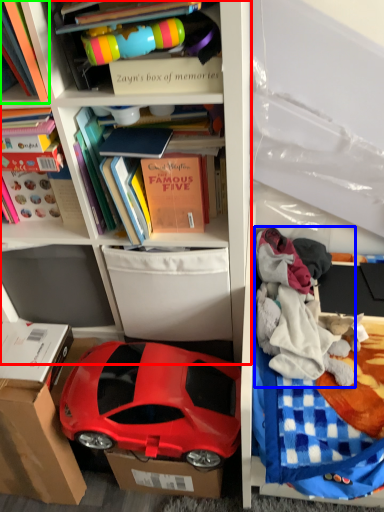
Question: Considering the real-world distances, which object is closest to shelf (highlighted by a red box)? clothing (highlighted by a blue box) or book (highlighted by a green box).

Choices:
 (A) clothing
 (B) book

Answer: (A)